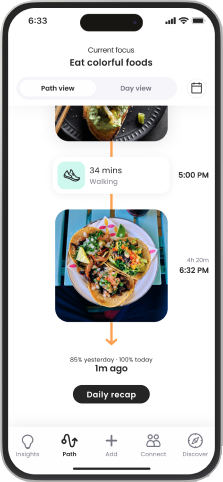
Locate an element on the screen. This screenshot has width=223, height=482. clock is located at coordinates (36, 23).